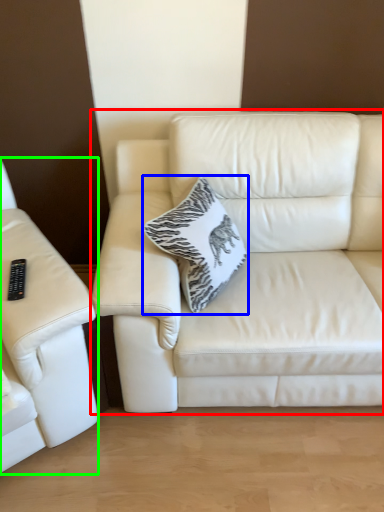
Question: Considering the real-world distances, which object is farthest from studio couch (highlighted by a red box)? throw pillow (highlighted by a blue box) or studio couch (highlighted by a green box)?

Choices:
 (A) throw pillow
 (B) studio couch

Answer: (B)